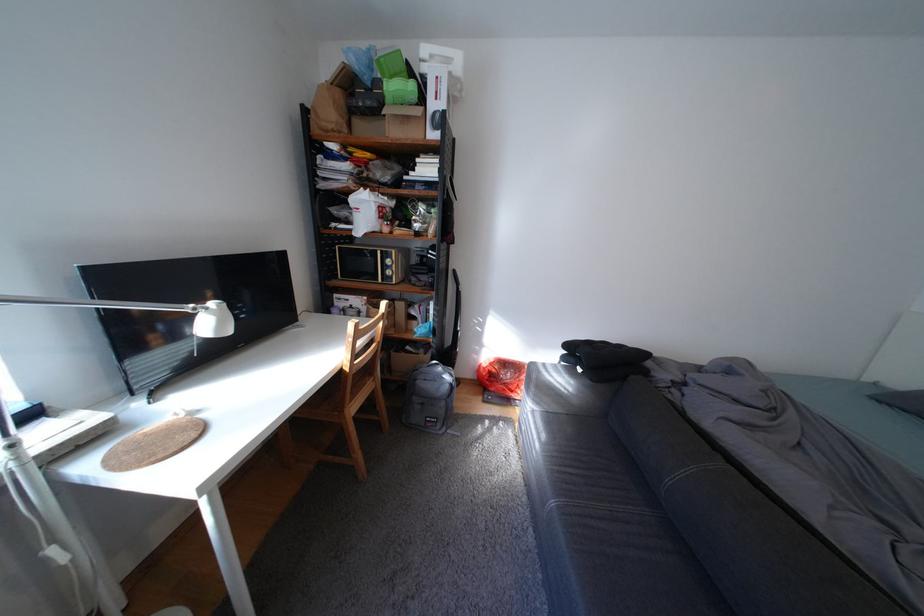
Where would you sit the chair sitting surface? Please return your answer as a coordinate pair (x, y).

(322, 411)